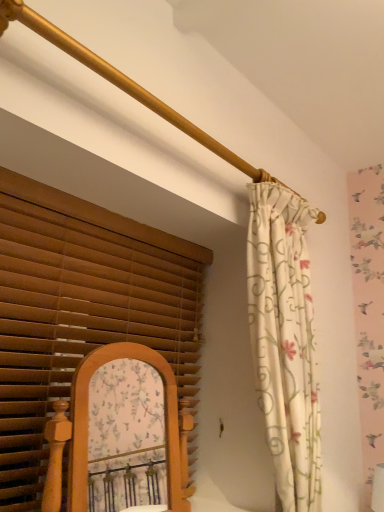
Identify the location of blank space situated above brown wood blinds at left (from a real-world perspective). pos(134,217).